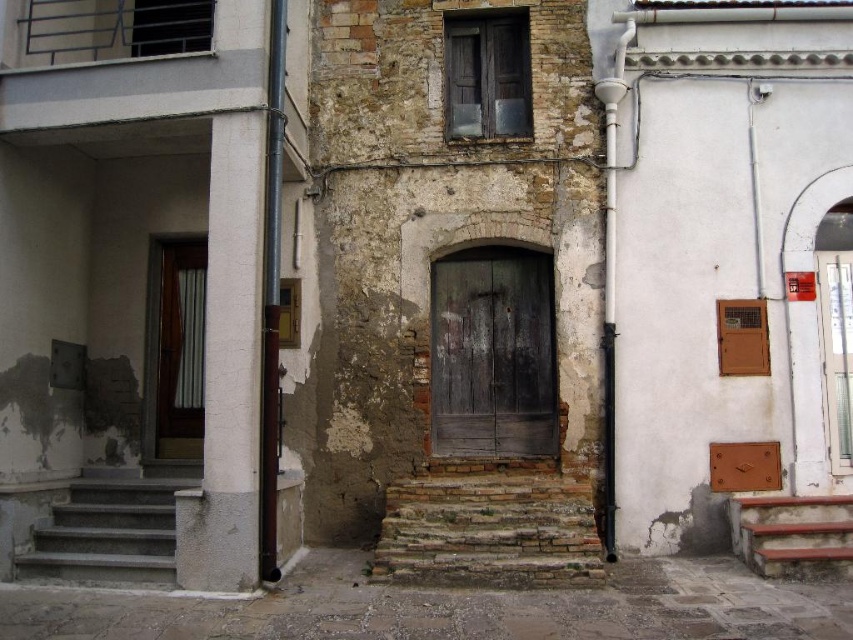
Is dark brown wooden door at center bigger than gray concrete stairs at lower left?

Yes, dark brown wooden door at center is bigger than gray concrete stairs at lower left.

Is dark brown wooden door at center closer to camera compared to gray concrete stairs at lower left?

No, it is not.

In order to click on dark brown wooden door at center in this screenshot , I will do `click(492, 353)`.

Can you confirm if rustic wooden stairs at lower right is bigger than wooden door at center?

Yes, rustic wooden stairs at lower right is bigger than wooden door at center.

Does rustic wooden stairs at lower right have a lesser width compared to wooden door at center?

No.

This screenshot has height=640, width=853. Identify the location of rustic wooden stairs at lower right. (793, 534).

You are a GUI agent. You are given a task and a screenshot of the screen. Output one action in this format:
    pyautogui.click(x=<x>, y=<y>)
    Task: Click on the rustic wooden stairs at lower right
    The width and height of the screenshot is (853, 640).
    Given the screenshot: What is the action you would take?
    [793, 534]

Measure the distance between rustic stone stairs at center and rustic wooden stairs at lower right.

1.98 meters

Is rustic stone stairs at center to the right of rustic wooden stairs at lower right from the viewer's perspective?

No, rustic stone stairs at center is not to the right of rustic wooden stairs at lower right.

Find the location of a particular element. This screenshot has height=640, width=853. rustic stone stairs at center is located at coordinates (489, 531).

Image resolution: width=853 pixels, height=640 pixels. What are the coordinates of `rustic stone stairs at center` in the screenshot? It's located at (489, 531).